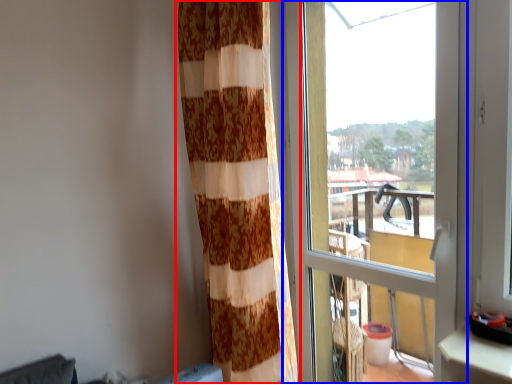
Question: Which of the following is the closest to the observer, curtain (highlighted by a red box) or window (highlighted by a blue box)?

Choices:
 (A) curtain
 (B) window

Answer: (B)